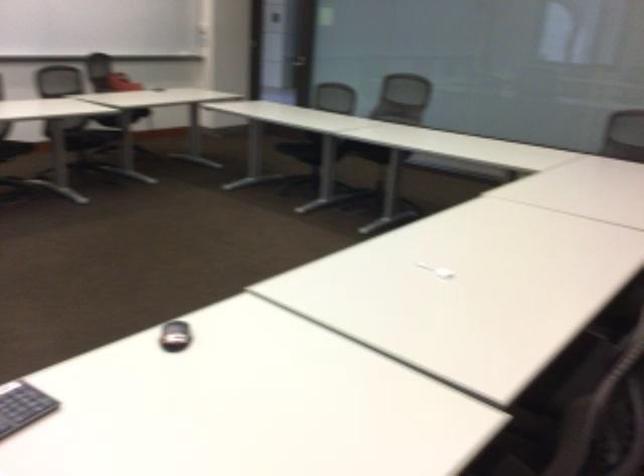
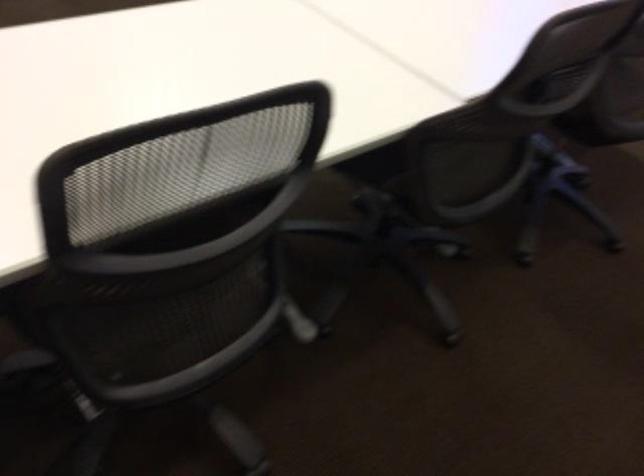
Question: The images are taken continuously from a first-person perspective. In which direction are you moving?

Choices:
 (A) Left
 (B) Right
 (C) Forward
 (D) Backward

Answer: (D)